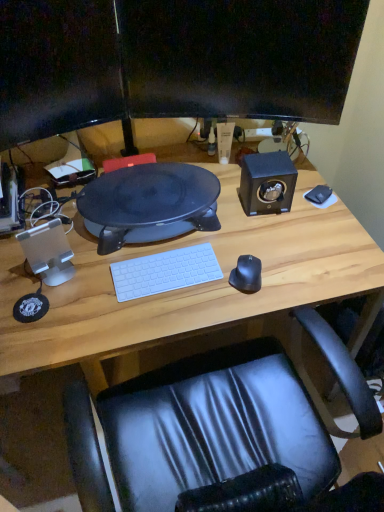
Locate an element on the screen. blank area to the left of black matte mouse at right is located at coordinates (195, 300).